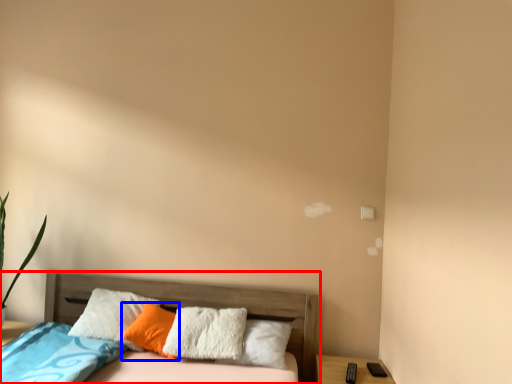
Question: Which point is further to the camera, bed (highlighted by a red box) or pillow (highlighted by a blue box)?

Choices:
 (A) bed
 (B) pillow

Answer: (B)